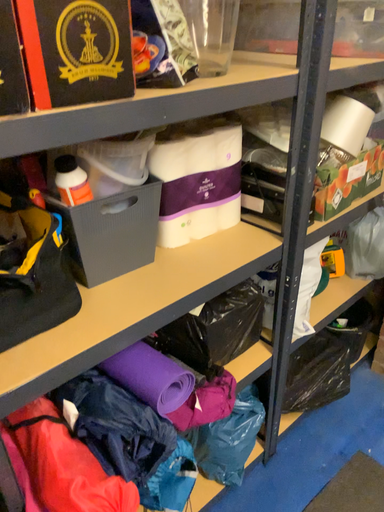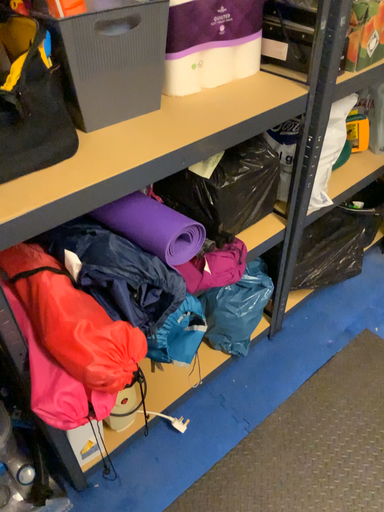
Question: How did the camera likely rotate when shooting the video?

Choices:
 (A) rotated downward
 (B) rotated upward

Answer: (A)